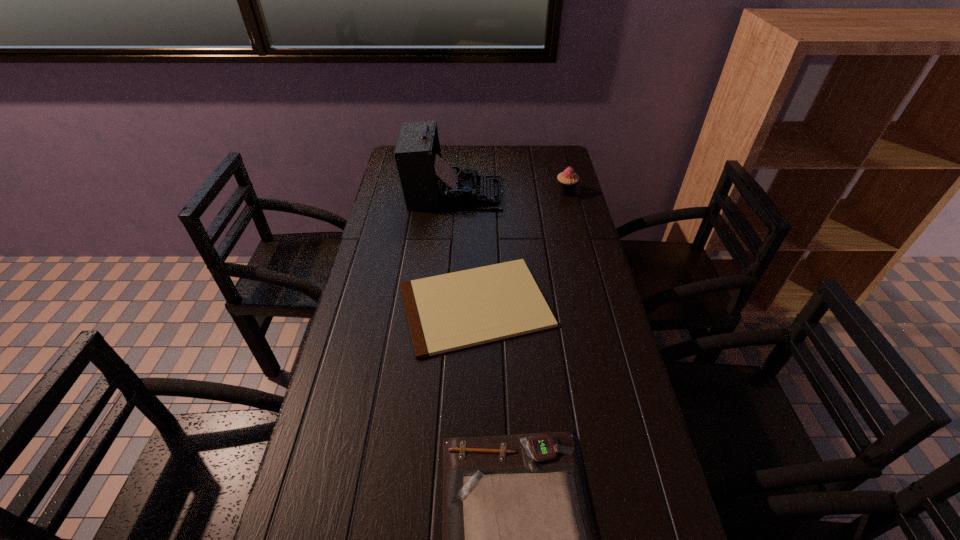
This screenshot has height=540, width=960. Identify the location of unoccupied area between the rightmost object and the tallest object. (511, 193).

Where is `free point between the cupcake and the typewriter`? The width and height of the screenshot is (960, 540). free point between the cupcake and the typewriter is located at coordinates (511, 193).

Locate an element on the screen. The image size is (960, 540). the second closest object to the nearest object is located at coordinates (428, 182).

Identify which object is the third nearest to the typewriter. Please provide its 2D coordinates. Your answer should be formatted as a tuple, i.e. [(x, y)], where the tuple contains the x and y coordinates of a point satisfying the conditions above.

[(518, 538)]

Locate an element on the screen. This screenshot has width=960, height=540. free space in the image that satisfies the following two spatial constraints: 1. inside the open case of the farther clipboard; 2. on the left side of the typewriter is located at coordinates (446, 305).

You are a GUI agent. You are given a task and a screenshot of the screen. Output one action in this format:
    pyautogui.click(x=<x>, y=<y>)
    Task: Click on the vacant point that satisfies the following two spatial constraints: 1. inside the open case of the shorter clipboard; 2. on the right side of the tallest object
    This screenshot has width=960, height=540.
    Given the screenshot: What is the action you would take?
    pyautogui.click(x=446, y=305)

I want to click on vacant space that satisfies the following two spatial constraints: 1. on the back side of the farther clipboard; 2. on the right side of the third shortest object, so click(476, 192).

This screenshot has width=960, height=540. Find the location of `vacant space that satisfies the following two spatial constraints: 1. inside the open case of the farther clipboard; 2. on the right side of the typewriter`. vacant space that satisfies the following two spatial constraints: 1. inside the open case of the farther clipboard; 2. on the right side of the typewriter is located at coordinates (446, 305).